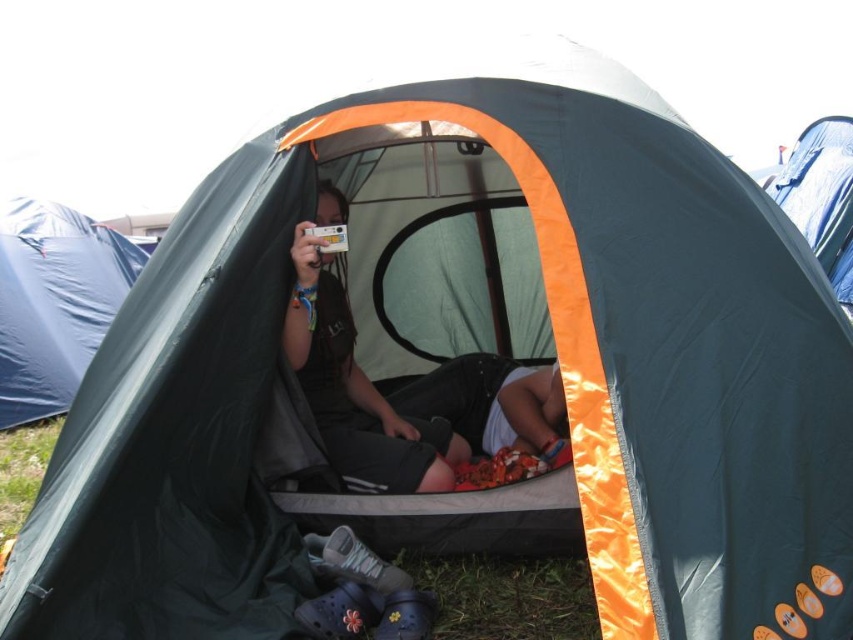
You are a photographer carrying a tripod that requires 2.5 meters of space to set up. You are standing near the matte black shorts at center and want to set up your equipment towards the blue tarpaulin tent at upper right. Is there enough space between them to set up your tripod?

The distance between the matte black shorts at center and the blue tarpaulin tent at upper right is 3.08 meters, which is more than the required 2.5 meters. Therefore, there is sufficient space to set up the tripod.

From the picture: You are setting up a tent and want to place a heavy camping gear box. You see the blue tarpaulin tent at left and the blue tarpaulin tent at upper right. Which tent should you place the box under to avoid it getting wet if it rains?

The blue tarpaulin tent at upper right is the better choice because the blue tarpaulin tent at left is positioned under it. Placing the box under the upper tent would provide better shelter from rain.